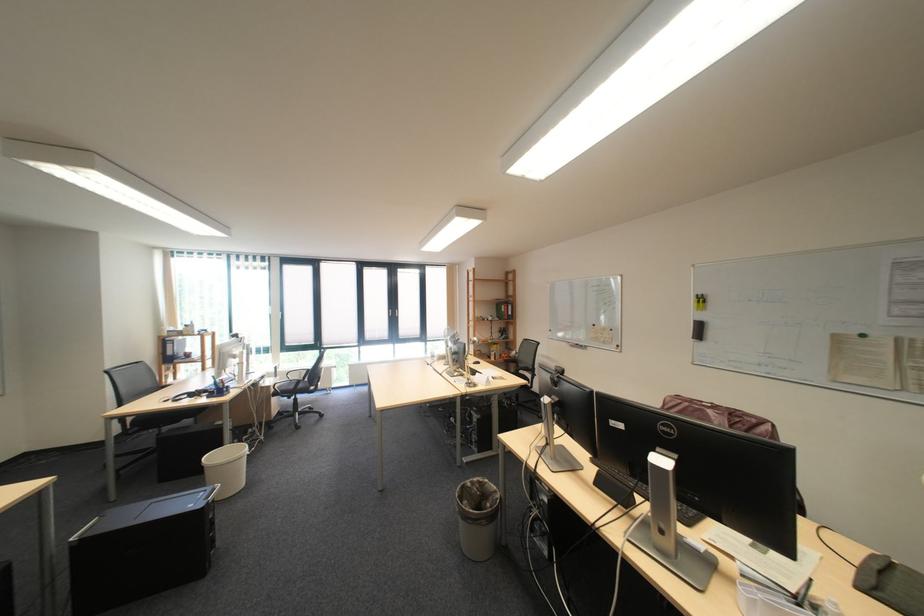
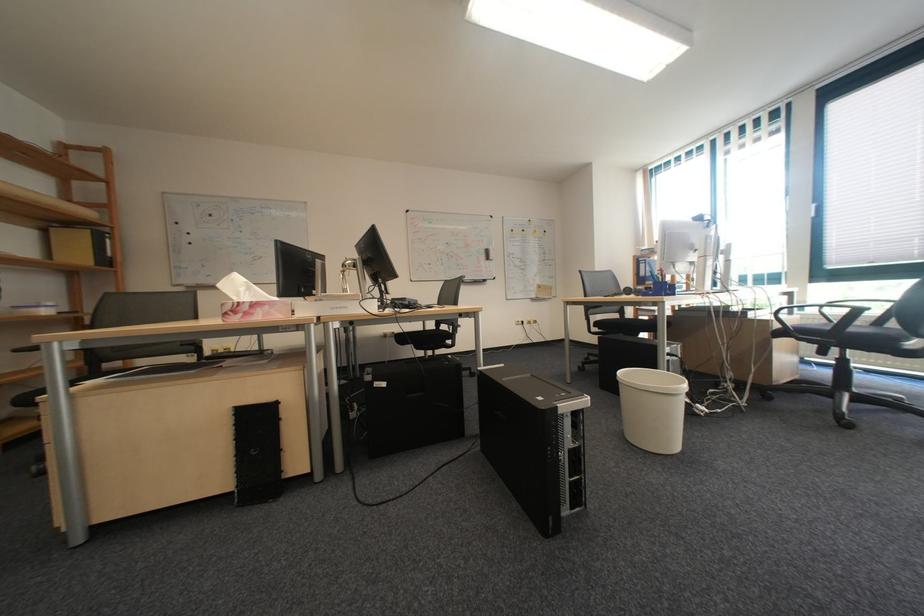
Where in the second image is the point corresponding to [122,373] from the first image?

(593, 273)